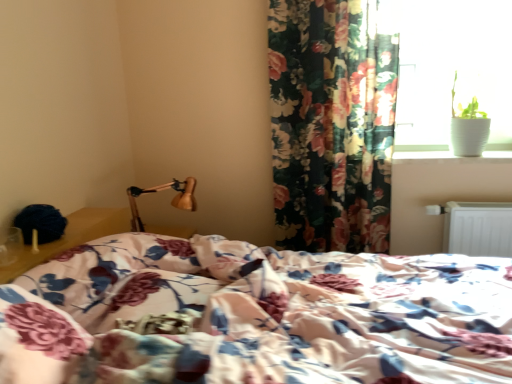
In order to click on blank area beneath white ceramic pot at upper right (from a real-world perspective) in this screenshot , I will do `click(448, 154)`.